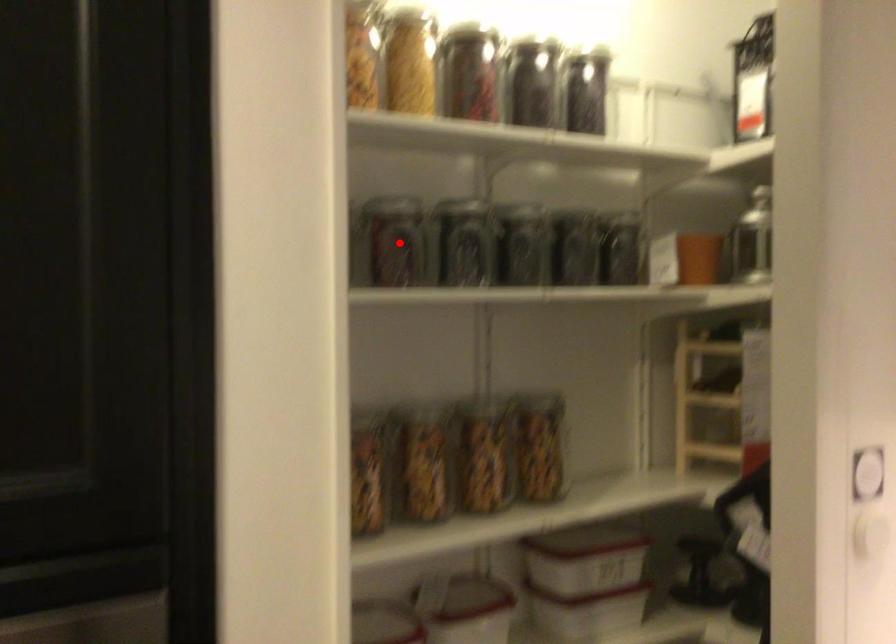
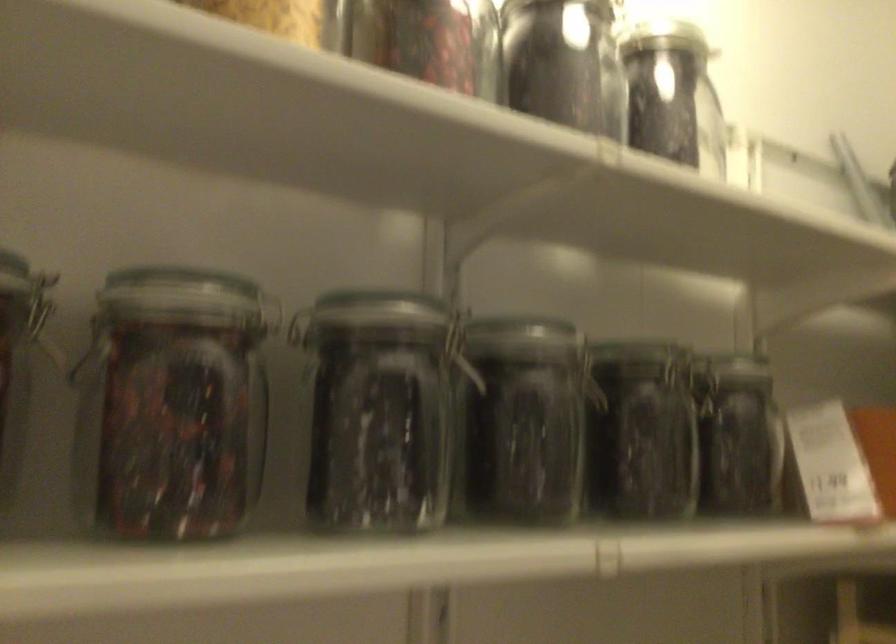
Question: I am providing you with two images of the same scene from different viewpoints. Image1 has a red point marked. In image2, the corresponding 3D location appears at what relative position? Reply with the corresponding letter.

Choices:
 (A) Closer
 (B) Farther

Answer: (A)